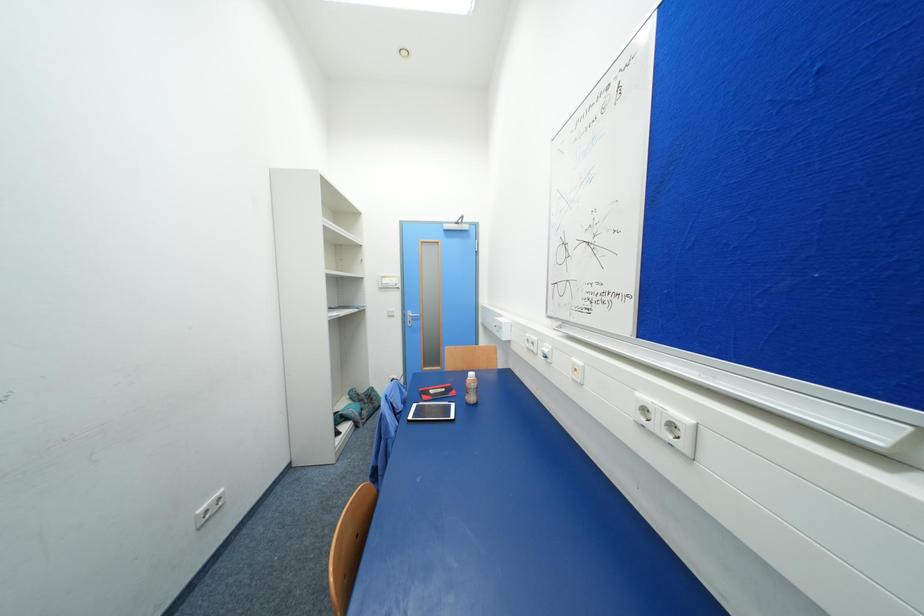
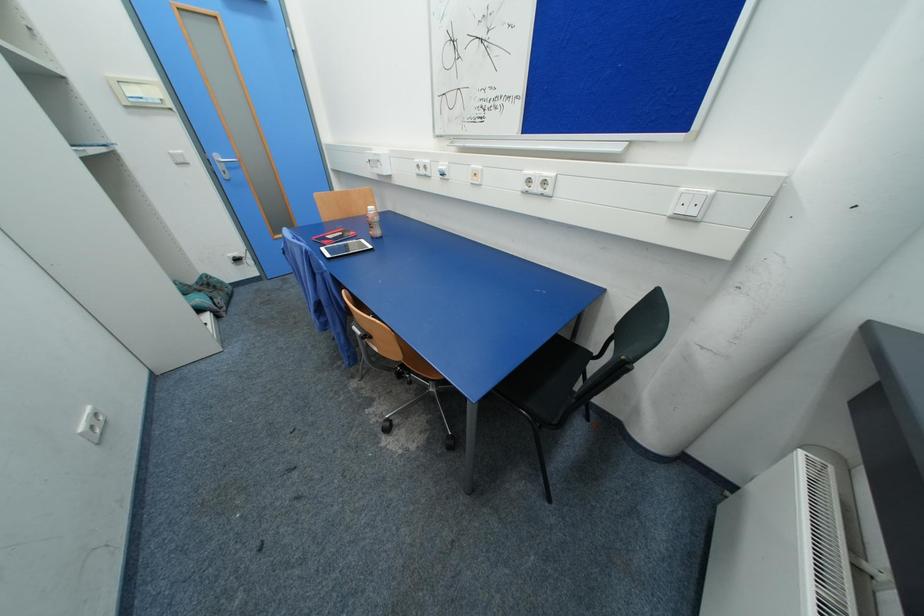
First-person continuous shooting, in which direction is the camera rotating?

The camera rotated toward right-down.